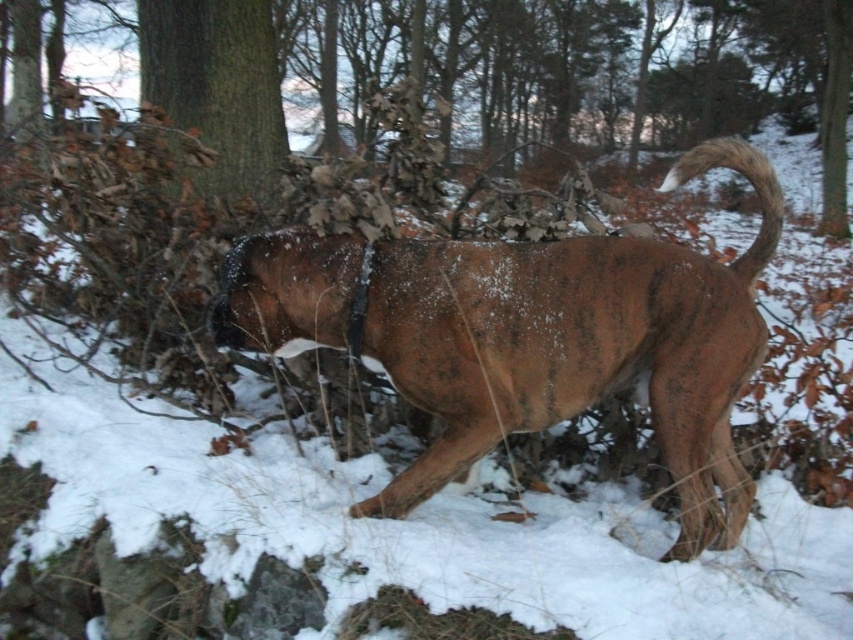
Based on the photo, you are a hiker trying to locate the brown rough bark at upper center. You see the brown fur dog at center. Based on their positions, where should you look relative to the dog?

The brown fur dog at center is in front of brown rough bark at upper center, so you should look behind the dog to find the brown rough bark at upper center.

You are standing in a snowy forest and see a brown fur dog at center and a brown bark tree at center. Which one is positioned more to the left?

The brown fur dog at center is positioned to the left of the brown bark tree at center.

You are a hiker who has just spotted a dog in the snowy forest. You see the point marked at coordinates (578, 346). What is the object located at that point?

The point at coordinates (578, 346) marks the brown fur dog at center.